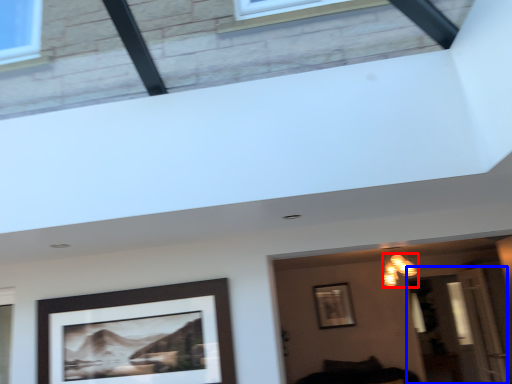
Question: Which object appears farthest to the camera in this image, light fixture (highlighted by a red box) or glass door (highlighted by a blue box)?

Choices:
 (A) light fixture
 (B) glass door

Answer: (B)